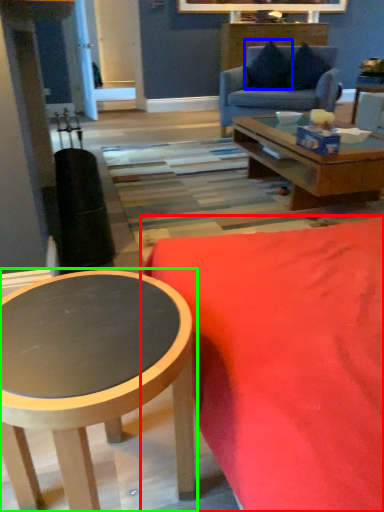
Question: Which object is the farthest from studio couch (highlighted by a red box)? Choose among these: pillow (highlighted by a blue box) or coffee table (highlighted by a green box).

Choices:
 (A) pillow
 (B) coffee table

Answer: (A)